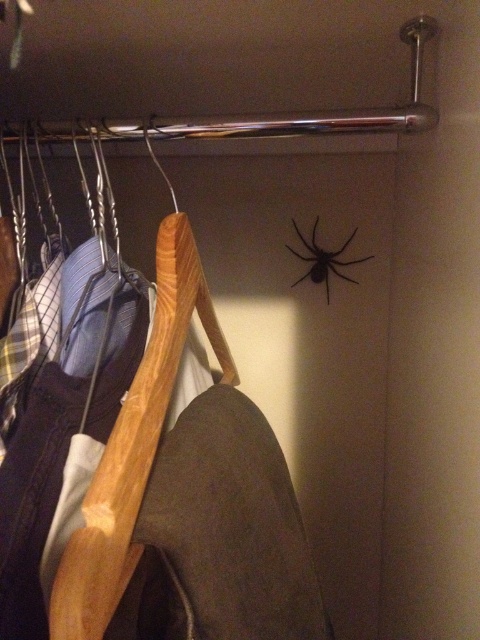
You are organizing a closet and notice the wooden hanger at left and the black matte spider at upper center. Which object is positioned more to the left side of the closet?

The wooden hanger at left is positioned more to the left side of the closet than the black matte spider at upper center.

You are trying to hang a new jacket on the wooden hanger at left in the closet. The jacket requires 14 inches of space between the hanger and the metal rod above it. Is there enough space?

The wooden hanger at left is 13.52 inches away from the metal rod, which is less than the required 14 inches. Therefore, there isn not enough space to hang the jacket properly.